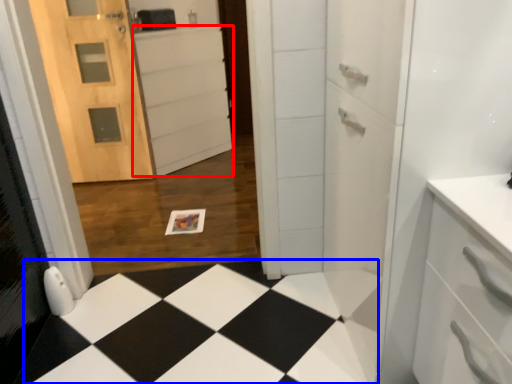
Question: Which object is closer to the camera taking this photo, cabinetry (highlighted by a red box) or square (highlighted by a blue box)?

Choices:
 (A) cabinetry
 (B) square

Answer: (B)